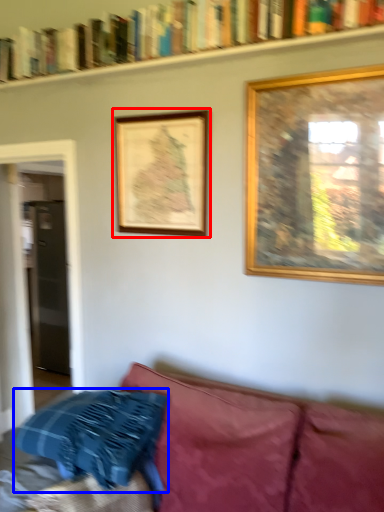
Question: Which object appears closest to the camera in this image, picture frame (highlighted by a red box) or pillow (highlighted by a blue box)?

Choices:
 (A) picture frame
 (B) pillow

Answer: (B)